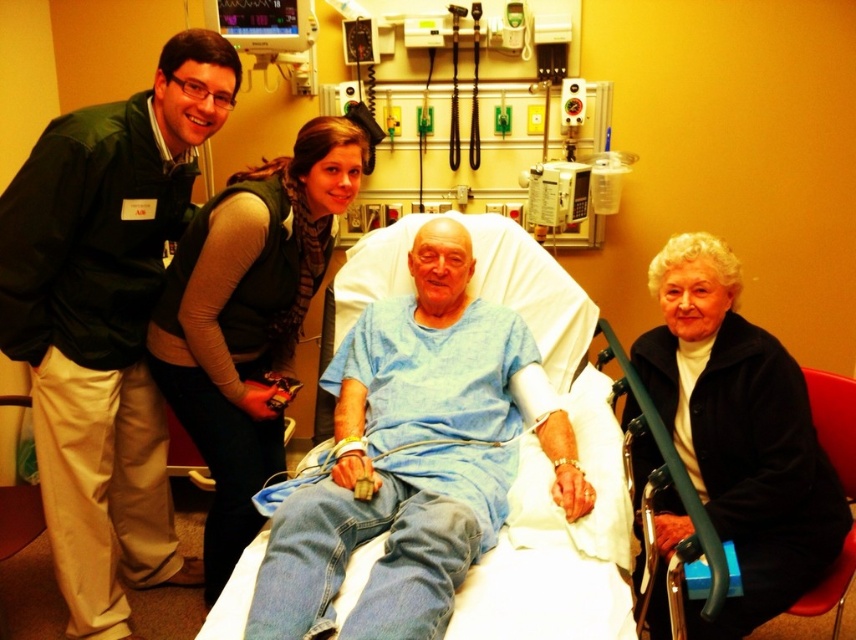
Question: Is black fleece jacket at lower right to the left of dark green vest at upper left from the viewer's perspective?

Choices:
 (A) no
 (B) yes

Answer: (A)

Question: Which point is farther to the camera?

Choices:
 (A) dark green vest at upper left
 (B) blue cotton shirt at center
 (C) green fabric vest at upper left

Answer: (A)

Question: Which object is the closest to the green fabric vest at upper left?

Choices:
 (A) black fleece jacket at lower right
 (B) metallic medical monitor at upper center

Answer: (B)

Question: Which point appears closest to the camera in this image?

Choices:
 (A) (387, 177)
 (B) (391, 536)
 (C) (247, 499)
 (D) (658, 408)

Answer: (B)

Question: Can you confirm if blue cotton shirt at center is bigger than metallic medical monitor at upper center?

Choices:
 (A) no
 (B) yes

Answer: (A)

Question: Does green fabric vest at upper left appear over dark green vest at upper left?

Choices:
 (A) no
 (B) yes

Answer: (B)